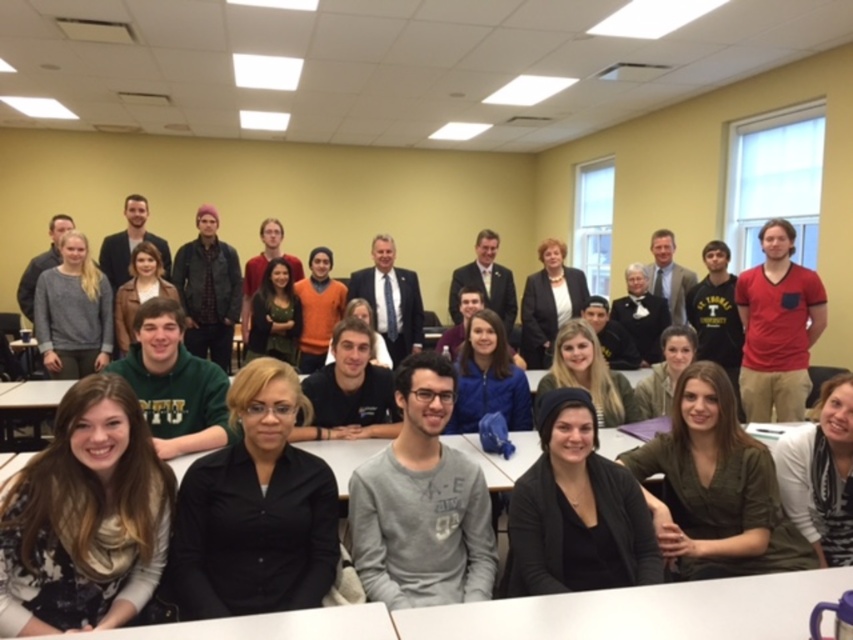
In the image of the group in the classroom, where is the plaid flannel shirt at center relative to the dark gray suit at center?

The plaid flasion shirt at center is to the left of the dark gray suit at center.

You are organizing a photo shoot and need to arrange the red cotton shirt at right and dark gray suit at center based on their widths. Which one should be placed on the narrower side of the frame?

The red cotton shirt at right has a lesser width compared to dark gray suit at center, so it should be placed on the narrower side of the frame.